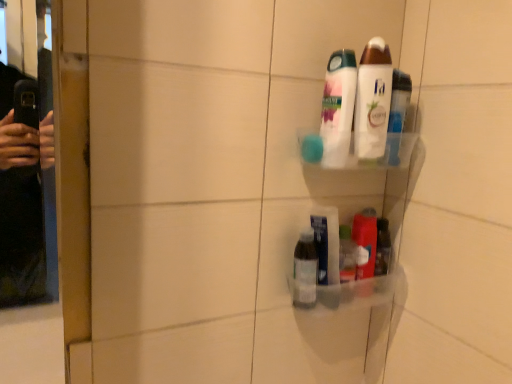
Question: Considering the relative sizes of white glossy lotion at upper center, the 4th toiletry ordered from the bottom, and translucent plastic container at lower right, the 2th toiletry ordered from the bottom, in the image provided, is white glossy lotion at upper center, the 4th toiletry ordered from the bottom, thinner than translucent plastic container at lower right, the 2th toiletry ordered from the bottom,?

Choices:
 (A) yes
 (B) no

Answer: (A)

Question: Does white glossy lotion at upper center, which is the 1th toiletry from top to bottom, have a lesser height compared to translucent plastic container at lower right, the 2th toiletry ordered from the bottom?

Choices:
 (A) yes
 (B) no

Answer: (B)

Question: From the image's perspective, is white glossy lotion at upper center, the 4th toiletry ordered from the bottom, located beneath translucent plastic container at lower right, the 2th toiletry ordered from the bottom?

Choices:
 (A) yes
 (B) no

Answer: (B)

Question: Does white glossy lotion at upper center, the 4th toiletry ordered from the bottom, have a greater height compared to translucent plastic container at lower right, the 2th toiletry ordered from the bottom?

Choices:
 (A) no
 (B) yes

Answer: (B)

Question: Are white glossy lotion at upper center, which is the 1th toiletry from top to bottom, and translucent plastic container at lower right, the 2th toiletry ordered from the bottom, far apart?

Choices:
 (A) no
 (B) yes

Answer: (A)

Question: Is transparent plastic bottle at lower center spatially inside clear plastic bottle at lower center, marked as the first toiletry in a bottom-to-top arrangement, or outside of it?

Choices:
 (A) outside
 (B) inside

Answer: (A)

Question: Considering the positions of transparent plastic bottle at lower center and clear plastic bottle at lower center, marked as the first toiletry in a bottom-to-top arrangement, in the image, is transparent plastic bottle at lower center taller or shorter than clear plastic bottle at lower center, marked as the first toiletry in a bottom-to-top arrangement,?

Choices:
 (A) tall
 (B) short

Answer: (A)

Question: From the image's perspective, relative to clear plastic bottle at lower center, the 4th toiletry in the top-to-bottom sequence, is transparent plastic bottle at lower center above or below?

Choices:
 (A) below
 (B) above

Answer: (B)

Question: Is transparent plastic bottle at lower center wider or thinner than clear plastic bottle at lower center, marked as the first toiletry in a bottom-to-top arrangement?

Choices:
 (A) thin
 (B) wide

Answer: (B)

Question: From the image's perspective, is translucent plastic container at lower right, which ranks as the 3th toiletry in top-to-bottom order, positioned above or below transparent plastic bottle at lower center?

Choices:
 (A) below
 (B) above

Answer: (A)

Question: Does point (361, 289) appear closer or farther from the camera than point (333, 269)?

Choices:
 (A) farther
 (B) closer

Answer: (A)

Question: Considering the positions of translucent plastic container at lower right, which ranks as the 3th toiletry in top-to-bottom order, and transparent plastic bottle at lower center in the image, is translucent plastic container at lower right, which ranks as the 3th toiletry in top-to-bottom order, taller or shorter than transparent plastic bottle at lower center?

Choices:
 (A) tall
 (B) short

Answer: (B)

Question: Considering the positions of translucent plastic container at lower right, the 2th toiletry ordered from the bottom, and transparent plastic bottle at lower center in the image, is translucent plastic container at lower right, the 2th toiletry ordered from the bottom, wider or thinner than transparent plastic bottle at lower center?

Choices:
 (A) wide
 (B) thin

Answer: (B)

Question: Is white glossy lotion at upper center, the 4th toiletry ordered from the bottom, spatially inside translucent plastic container at lower right, which ranks as the 3th toiletry in top-to-bottom order, or outside of it?

Choices:
 (A) outside
 (B) inside

Answer: (A)

Question: From the image's perspective, is white glossy lotion at upper center, which is the 1th toiletry from top to bottom, above or below translucent plastic container at lower right, which ranks as the 3th toiletry in top-to-bottom order?

Choices:
 (A) above
 (B) below

Answer: (A)